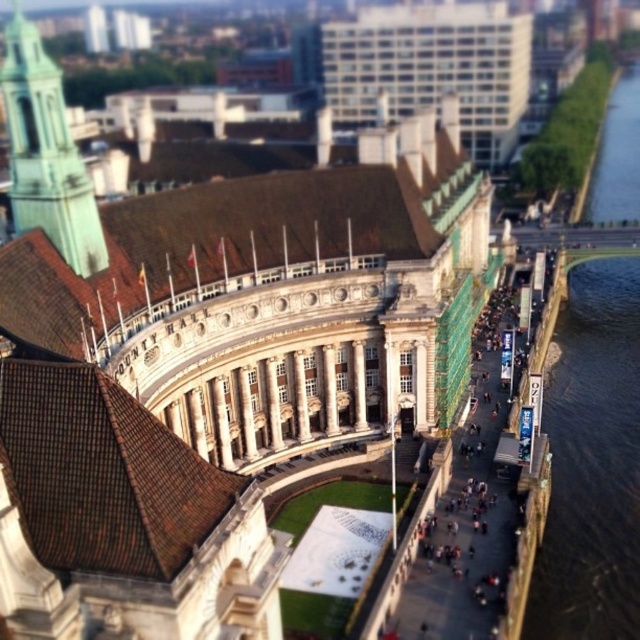
Question: Does green water at right have a smaller size compared to green glass tower at upper left?

Choices:
 (A) yes
 (B) no

Answer: (B)

Question: Which point is farther to the camera?

Choices:
 (A) (67, 204)
 (B) (560, 422)

Answer: (B)

Question: Which of the following is the closest to the observer?

Choices:
 (A) (563, 612)
 (B) (88, 237)

Answer: (B)

Question: Can you confirm if green water at right is positioned below green glass tower at upper left?

Choices:
 (A) yes
 (B) no

Answer: (A)

Question: Which object appears closest to the camera in this image?

Choices:
 (A) green water at right
 (B) green glass tower at upper left

Answer: (B)

Question: Does green water at right appear on the left side of green glass tower at upper left?

Choices:
 (A) yes
 (B) no

Answer: (B)